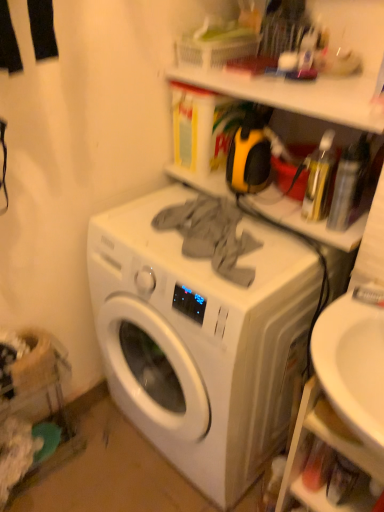
Find the location of a particular element. The image size is (384, 512). free space above white matte washing machine at center (from a real-world perspective) is located at coordinates (231, 242).